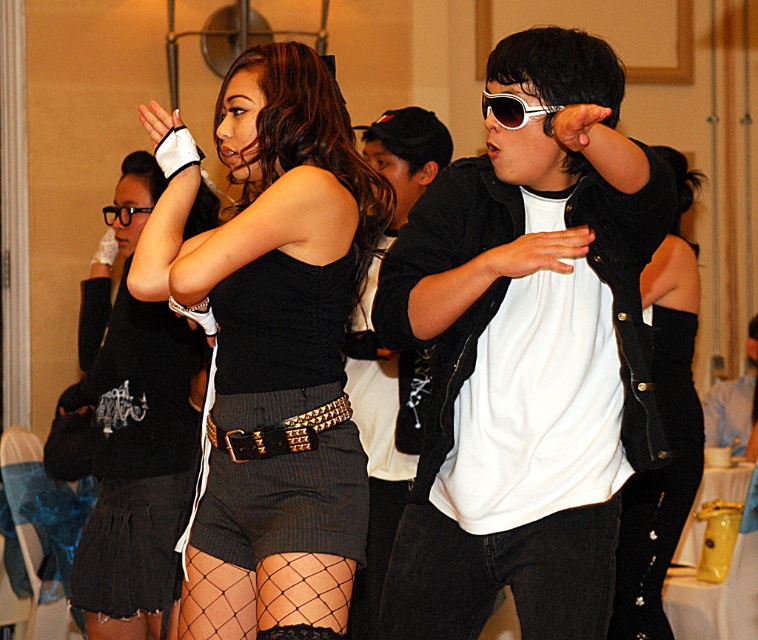
Question: Can you confirm if black matte dress at center is positioned below black velvet vest at right?

Choices:
 (A) no
 (B) yes

Answer: (A)

Question: Does black leather jacket at center appear under studded leather belt at center?

Choices:
 (A) no
 (B) yes

Answer: (A)

Question: Is black velvet vest at right smaller than studded leather belt at center?

Choices:
 (A) yes
 (B) no

Answer: (B)

Question: Which of these objects is positioned farthest from the white matte shirt at center?

Choices:
 (A) black velvet vest at right
 (B) studded leather belt at center

Answer: (A)

Question: Which point is farther to the camera?

Choices:
 (A) (237, 324)
 (B) (121, 218)
 (C) (99, 460)

Answer: (B)

Question: Which of the following is the closest to the observer?

Choices:
 (A) (637, 531)
 (B) (284, 440)
 (C) (594, 380)
 (D) (252, 557)

Answer: (B)